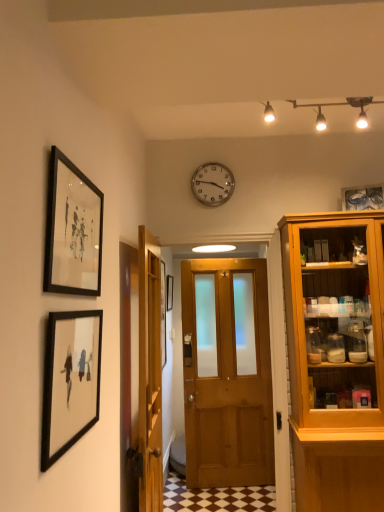
This screenshot has width=384, height=512. Describe the element at coordinates (227, 373) in the screenshot. I see `wooden door at center, the 1th door positioned from the right` at that location.

Describe the element at coordinates (363, 198) in the screenshot. I see `clear glass picture frame at upper right, which appears as the fourth picture frame when viewed from the left` at that location.

In order to face black matte picture frame at center, which is the 1th picture frame in back-to-front order, should I rotate leftwards or rightwards?

To align with it, rotate left about 2.934°.

Describe the element at coordinates (212, 184) in the screenshot. This screenshot has width=384, height=512. I see `silver metallic clock at upper center` at that location.

Describe the element at coordinates (150, 372) in the screenshot. I see `wooden door at center, the second door positioned from the right` at that location.

This screenshot has height=512, width=384. Find the location of `white glossy track lights at upper center`. white glossy track lights at upper center is located at coordinates (340, 105).

Does white glossy track lights at upper center appear on the right side of black matte picture frame at upper left, marked as the 2th picture frame in a left-to-right arrangement?

Indeed, white glossy track lights at upper center is positioned on the right side of black matte picture frame at upper left, marked as the 2th picture frame in a left-to-right arrangement.

Is white glossy track lights at upper center facing away from black matte picture frame at upper left, positioned as the 3th picture frame in right-to-left order?

white glossy track lights at upper center does not have its back to black matte picture frame at upper left, positioned as the 3th picture frame in right-to-left order.

From a real-world perspective, relative to black matte picture frame at upper left, marked as the 2th picture frame in a left-to-right arrangement, is white glossy track lights at upper center vertically above or below?

From a real-world perspective, white glossy track lights at upper center is physically above black matte picture frame at upper left, marked as the 2th picture frame in a left-to-right arrangement.

Is black matte picture frame at lower left, the 4th picture frame viewed from the back, shorter than silver metallic clock at upper center?

No.

Consider the image. From a real-world perspective, is black matte picture frame at lower left, positioned as the first picture frame in left-to-right order, physically located above or below silver metallic clock at upper center?

black matte picture frame at lower left, positioned as the first picture frame in left-to-right order, is below silver metallic clock at upper center.

From the picture: Is black matte picture frame at lower left, arranged as the first picture frame when viewed from the front, wider or thinner than silver metallic clock at upper center?

Considering their sizes, black matte picture frame at lower left, arranged as the first picture frame when viewed from the front, looks slimmer than silver metallic clock at upper center.

Could you tell me if black matte picture frame at upper left, marked as the 2th picture frame in a left-to-right arrangement, is turned towards wooden door at center, the 2th door positioned from the left?

No.

From a real-world perspective, who is located lower, black matte picture frame at upper left, marked as the 2th picture frame in a left-to-right arrangement, or wooden door at center, the 1th door positioned from the right?

wooden door at center, the 1th door positioned from the right.

Who is smaller, black matte picture frame at upper left, the second picture frame from the front, or wooden door at center, the 1th door positioned from the right?

black matte picture frame at upper left, the second picture frame from the front.

At what (x,y) coordinates should I click in order to perform the action: click on picture frame that is the 2nd object to the left of the wooden door at center, the second door positioned from the right, starting at the anchor. Please return your answer as a coordinate pair (x, y). The image size is (384, 512). Looking at the image, I should click on (70, 381).

From the image's perspective, would you say black matte picture frame at lower left, arranged as the first picture frame when viewed from the front, is positioned over wooden door at center, the second door positioned from the right?

Yes, from the image's perspective, black matte picture frame at lower left, arranged as the first picture frame when viewed from the front, is above wooden door at center, the second door positioned from the right.

Does black matte picture frame at lower left, the 4th picture frame from the right, appear on the left side of wooden door at center, the second door positioned from the right?

Correct, you'll find black matte picture frame at lower left, the 4th picture frame from the right, to the left of wooden door at center, the second door positioned from the right.

In the scene shown: Is wooden door at center, the second door positioned from the right, surrounded by black matte picture frame at lower left, the 4th picture frame viewed from the back?

No.

The height and width of the screenshot is (512, 384). I want to click on picture frame above the black matte picture frame at upper left, positioned as the 3th picture frame in right-to-left order (from the image's perspective), so click(363, 198).

Based on the photo, from a real-world perspective, is clear glass picture frame at upper right, which appears as the fourth picture frame when viewed from the left, over black matte picture frame at upper left, marked as the 2th picture frame in a left-to-right arrangement?

Correct, in the physical world, clear glass picture frame at upper right, which appears as the fourth picture frame when viewed from the left, is higher than black matte picture frame at upper left, marked as the 2th picture frame in a left-to-right arrangement.

How far apart are clear glass picture frame at upper right, positioned as the 3th picture frame in front-to-back order, and black matte picture frame at upper left, marked as the 2th picture frame in a left-to-right arrangement?

They are 1.84 meters apart.

From the image's perspective, is clear glass picture frame at upper right, positioned as the 3th picture frame in front-to-back order, positioned above or below black matte picture frame at upper left, the second picture frame from the front?

Clearly, from the image's perspective, clear glass picture frame at upper right, positioned as the 3th picture frame in front-to-back order, is above black matte picture frame at upper left, the second picture frame from the front.

Is wooden door at center, which is the first door in left-to-right order, touching black matte picture frame at upper left, positioned as the 3th picture frame in right-to-left order?

No, wooden door at center, which is the first door in left-to-right order, is not beside black matte picture frame at upper left, positioned as the 3th picture frame in right-to-left order.

Image resolution: width=384 pixels, height=512 pixels. What are the coordinates of `door that is the 2nd one when counting downward from the black matte picture frame at upper left, positioned as the 3th picture frame in right-to-left order (from the image's perspective)` in the screenshot? It's located at (150, 372).

Considering the sizes of objects wooden door at center, the second door positioned from the right, and black matte picture frame at upper left, positioned as the 3th picture frame in right-to-left order, in the image provided, who is smaller, wooden door at center, the second door positioned from the right, or black matte picture frame at upper left, positioned as the 3th picture frame in right-to-left order,?

black matte picture frame at upper left, positioned as the 3th picture frame in right-to-left order, is smaller.

From the image's perspective, does wooden door at center, the second door positioned from the right, appear higher than black matte picture frame at upper left, marked as the 2th picture frame in a left-to-right arrangement?

No.

Does black matte picture frame at lower left, arranged as the first picture frame when viewed from the front, turn towards clear glass picture frame at upper right, placed as the 1th picture frame when sorted from right to left?

No, black matte picture frame at lower left, arranged as the first picture frame when viewed from the front, is not oriented towards clear glass picture frame at upper right, placed as the 1th picture frame when sorted from right to left.

Is the depth of black matte picture frame at lower left, the 4th picture frame from the right, greater than that of clear glass picture frame at upper right, which is the second picture frame from back to front?

No, it is in front of clear glass picture frame at upper right, which is the second picture frame from back to front.

From the image's perspective, which object appears higher, black matte picture frame at lower left, the 4th picture frame from the right, or clear glass picture frame at upper right, placed as the 1th picture frame when sorted from right to left?

clear glass picture frame at upper right, placed as the 1th picture frame when sorted from right to left, is shown above in the image.

Consider the image. From a real-world perspective, is black matte picture frame at lower left, the 4th picture frame from the right, positioned over clear glass picture frame at upper right, which appears as the fourth picture frame when viewed from the left, based on gravity?

No, from a real-world perspective, black matte picture frame at lower left, the 4th picture frame from the right, is not on top of clear glass picture frame at upper right, which appears as the fourth picture frame when viewed from the left.

I want to click on picture frame that is the 2nd one when counting downward from the white glossy track lights at upper center (from the image's perspective), so click(72, 230).

From the silver metallic clock at upper center, count the 3rd picture frame to the left and point to it. Please provide its 2D coordinates.

[(70, 381)]

Which object lies nearer to the anchor point clear glass picture frame at upper right, which is the second picture frame from back to front, white glossy track lights at upper center or silver metallic clock at upper center?

The object closer to clear glass picture frame at upper right, which is the second picture frame from back to front, is white glossy track lights at upper center.

Looking at the image, which one is located further to clear glass picture frame at upper right, which appears as the fourth picture frame when viewed from the left, black matte picture frame at lower left, the 4th picture frame from the right, or silver metallic clock at upper center?

Among the two, black matte picture frame at lower left, the 4th picture frame from the right, is located further to clear glass picture frame at upper right, which appears as the fourth picture frame when viewed from the left.

Estimate the real-world distances between objects in this image. Which object is further from black matte picture frame at upper left, which ranks as the 3th picture frame in back-to-front order, clear glass picture frame at upper right, placed as the 1th picture frame when sorted from right to left, or wooden door at center, the 2th door positioned from the left?

wooden door at center, the 2th door positioned from the left, lies further to black matte picture frame at upper left, which ranks as the 3th picture frame in back-to-front order, than the other object.

Estimate the real-world distances between objects in this image. Which object is closer to clear glass picture frame at upper right, which is the second picture frame from back to front, wooden door at center, the 2th door positioned from the left, or white glossy track lights at upper center?

white glossy track lights at upper center is positioned closer to the anchor clear glass picture frame at upper right, which is the second picture frame from back to front.

From the image, which object appears to be nearer to black matte picture frame at lower left, the 4th picture frame viewed from the back, wooden door at center, the 1th door positioned from the right, or clear glass picture frame at upper right, placed as the 1th picture frame when sorted from right to left?

The object closer to black matte picture frame at lower left, the 4th picture frame viewed from the back, is clear glass picture frame at upper right, placed as the 1th picture frame when sorted from right to left.

Looking at the image, which one is located closer to clear glass picture frame at upper right, which appears as the fourth picture frame when viewed from the left, wooden door at center, the second door positioned from the right, or black matte picture frame at lower left, the 4th picture frame from the right?

Based on the image, wooden door at center, the second door positioned from the right, appears to be nearer to clear glass picture frame at upper right, which appears as the fourth picture frame when viewed from the left.

When comparing their distances from white glossy track lights at upper center, does wooden door at center, the 1th door positioned from the right, or silver metallic clock at upper center seem further?

wooden door at center, the 1th door positioned from the right, is positioned further to the anchor white glossy track lights at upper center.

Looking at the image, which one is located further to white glossy track lights at upper center, silver metallic clock at upper center or clear glass picture frame at upper right, placed as the 1th picture frame when sorted from right to left?

clear glass picture frame at upper right, placed as the 1th picture frame when sorted from right to left.

Locate an element on the screen. The width and height of the screenshot is (384, 512). door between white glossy track lights at upper center and wooden door at center, which is the first door in left-to-right order, from top to bottom is located at coordinates (227, 373).

Where is `picture frame between black matte picture frame at upper left, marked as the 2th picture frame in a left-to-right arrangement, and wooden door at center, the 1th door positioned from the right, from front to back`? Image resolution: width=384 pixels, height=512 pixels. picture frame between black matte picture frame at upper left, marked as the 2th picture frame in a left-to-right arrangement, and wooden door at center, the 1th door positioned from the right, from front to back is located at coordinates (363, 198).

Where is `picture frame between white glossy track lights at upper center and black matte picture frame at center, the 4th picture frame when ordered from front to back, in the front-back direction`? The image size is (384, 512). picture frame between white glossy track lights at upper center and black matte picture frame at center, the 4th picture frame when ordered from front to back, in the front-back direction is located at coordinates (363, 198).

Locate an element on the screen. The width and height of the screenshot is (384, 512). door between silver metallic clock at upper center and wooden door at center, which is the first door in left-to-right order, vertically is located at coordinates (227, 373).